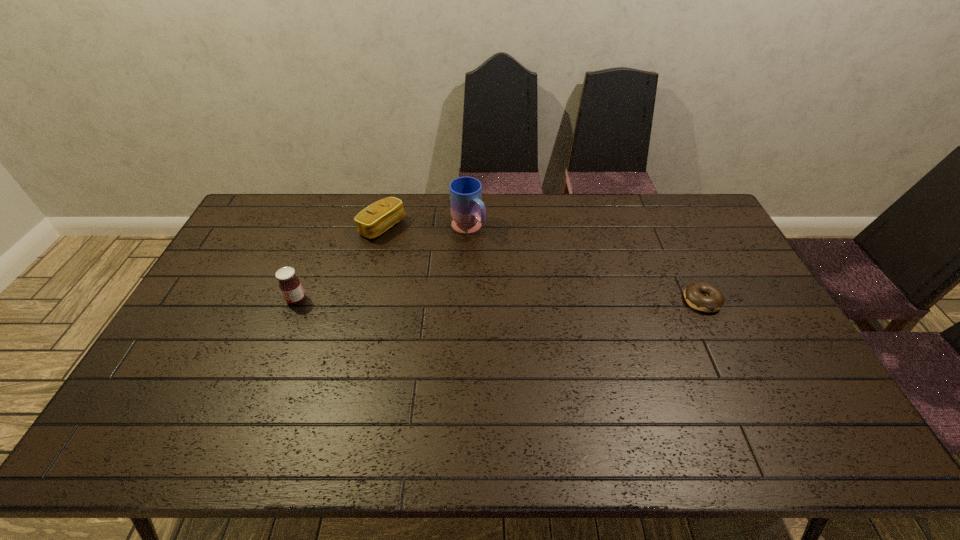
Locate an element on the screen. vacant space located 0.210m on the label side of the third shortest object is located at coordinates (217, 299).

Where is `vacant point located 0.380m on the back of the doughnut`? The width and height of the screenshot is (960, 540). vacant point located 0.380m on the back of the doughnut is located at coordinates (660, 214).

In order to click on free location located on the side of the tallest object with the handle in this screenshot , I will do `click(537, 294)`.

You are a GUI agent. You are given a task and a screenshot of the screen. Output one action in this format:
    pyautogui.click(x=<x>, y=<y>)
    Task: Click on the free space located 0.130m on the side of the tallest object with the handle
    
    Given the screenshot: What is the action you would take?
    pyautogui.click(x=500, y=260)

Find the location of a particular element. free space located 0.300m on the side of the tallest object with the handle is located at coordinates (532, 291).

Locate an element on the screen. Image resolution: width=960 pixels, height=540 pixels. vacant space positioned 0.330m on the zipper side of the clutch bag is located at coordinates click(468, 281).

You are a GUI agent. You are given a task and a screenshot of the screen. Output one action in this format:
    pyautogui.click(x=<x>, y=<y>)
    Task: Click on the free space located on the zipper side of the clutch bag
    The width and height of the screenshot is (960, 540).
    Given the screenshot: What is the action you would take?
    pyautogui.click(x=407, y=244)

This screenshot has height=540, width=960. I want to click on vacant space situated on the zipper side of the clutch bag, so click(432, 259).

Find the location of `mug present at the far edge`. mug present at the far edge is located at coordinates (468, 212).

Image resolution: width=960 pixels, height=540 pixels. I want to click on clutch bag present at the far edge, so click(380, 216).